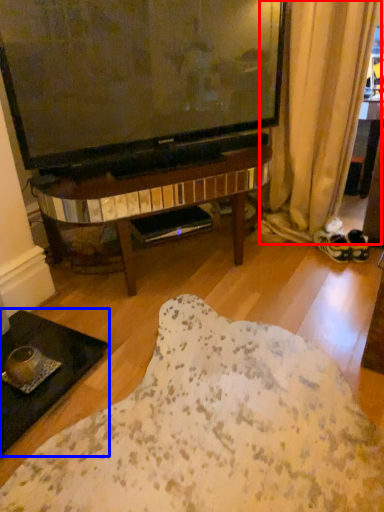
Question: Which of the following is the closest to the observer, curtain (highlighted by a red box) or coffee table (highlighted by a blue box)?

Choices:
 (A) curtain
 (B) coffee table

Answer: (B)